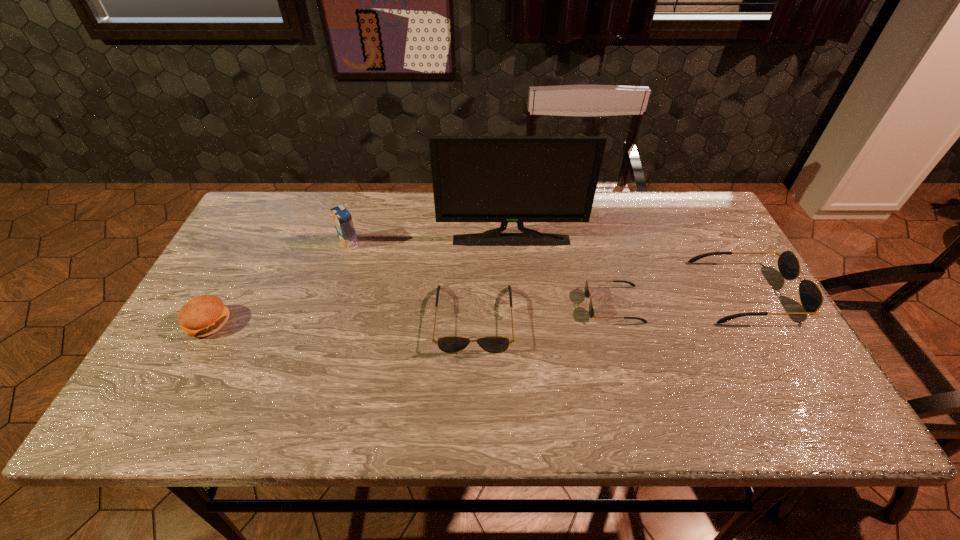
The width and height of the screenshot is (960, 540). I want to click on the second tallest sunglasses, so click(449, 344).

Identify the location of the shortest sunglasses. click(x=587, y=293).

Find the location of a particular element. the second sunglasses from right to left is located at coordinates (587, 293).

The image size is (960, 540). Find the location of `the rightmost object`. the rightmost object is located at coordinates (811, 297).

Find the location of a particular element. This screenshot has height=540, width=960. the second object from left to right is located at coordinates (x=342, y=218).

The image size is (960, 540). Identify the location of the fifth shortest object. (342, 218).

Where is `hamburger`? hamburger is located at coordinates (204, 315).

The height and width of the screenshot is (540, 960). I want to click on monitor, so click(x=504, y=179).

At what (x,y) coordinates should I click in order to perform the action: click on vacant space located 0.160m on the front-facing side of the shortest sunglasses. Please return your answer as a coordinate pair (x, y). The height and width of the screenshot is (540, 960). Looking at the image, I should click on (x=524, y=305).

Locate an element on the screen. free space located on the front-facing side of the shortest sunglasses is located at coordinates (532, 305).